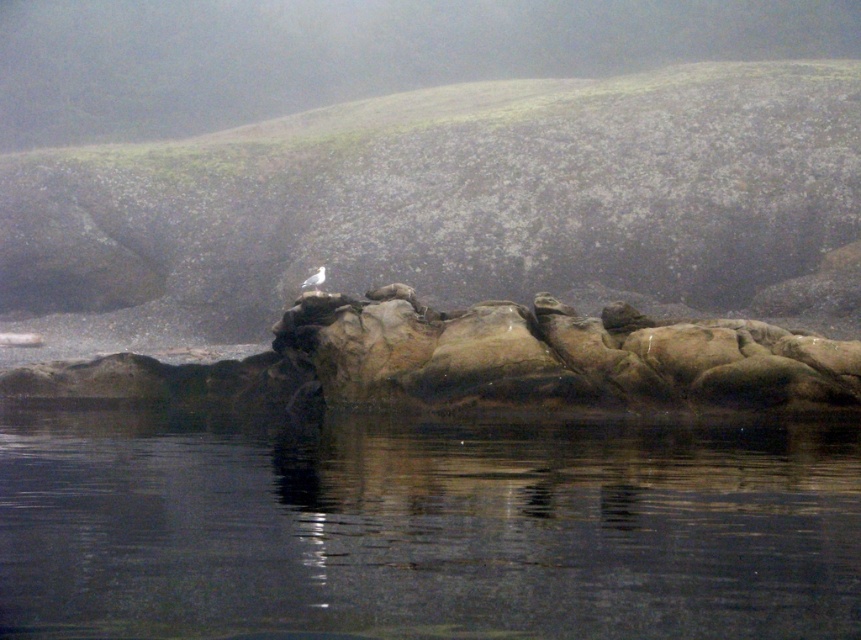
Who is positioned more to the right, transparent water at center or white matte bird at center?

transparent water at center

Is point (438, 584) farther from camera compared to point (307, 284)?

No, it is in front of (307, 284).

At what (x,y) coordinates should I click in order to perform the action: click on transparent water at center. Please return your answer as a coordinate pair (x, y). The width and height of the screenshot is (861, 640). Looking at the image, I should click on (423, 529).